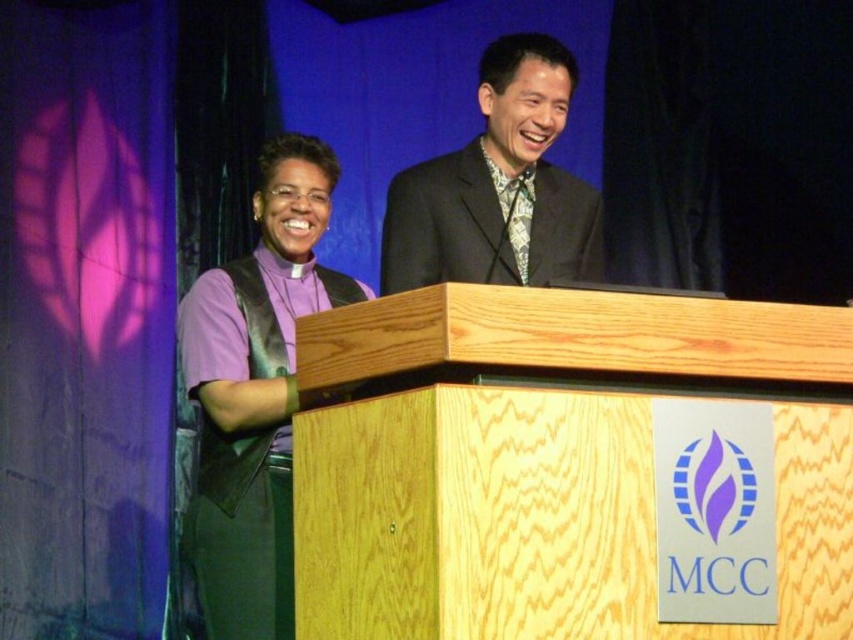
You are standing in front of the wooden podium at the event. There are two points marked on the podium surface. The first point is at coordinates point (271, 262) and the second point is at point (438, 208). If you want to place a small object closer to you, which point should you choose?

You should choose point (271, 262) because it is closer to you than point (438, 208).

You are an event photographer positioned at the back of the room. You want to capture a photo of the purple matte vest at left without the light wood podium at center blocking the view. Is this possible based on their positions?

The light wood podium at center is in front of the purple matte vest at left, so it will block the view. Move to the side to avoid the podium.

You are attending a conference and need to locate the presenter wearing the purple matte vest at left. Based on the coordinates provided, can you determine if this vest is positioned to the left or right of the center point of the image?

The purple matte vest at left is located at point 0.614 on the x axis and 0.300 on the y axis. Since the x coordinate is greater than 0.5, it is positioned to the right of the center point of the image.